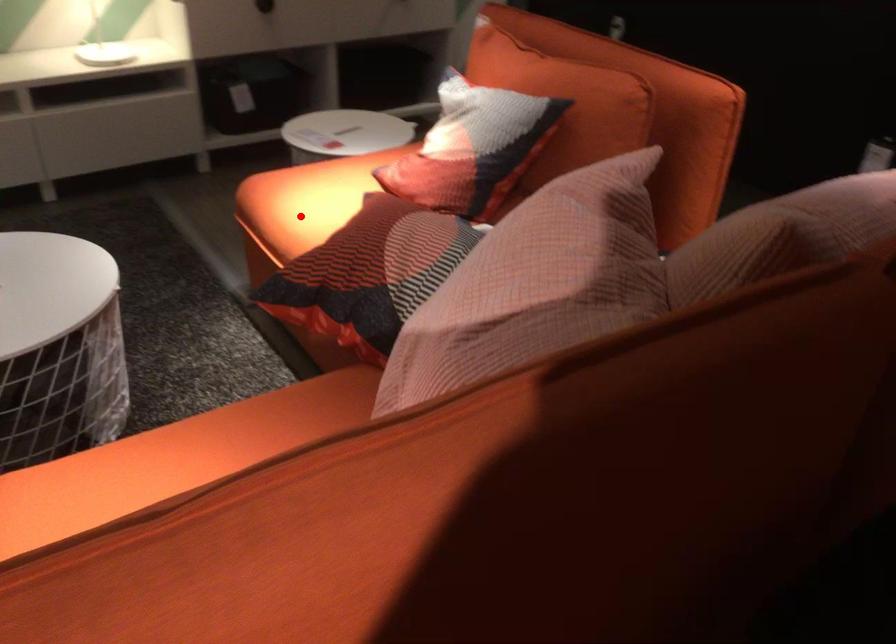
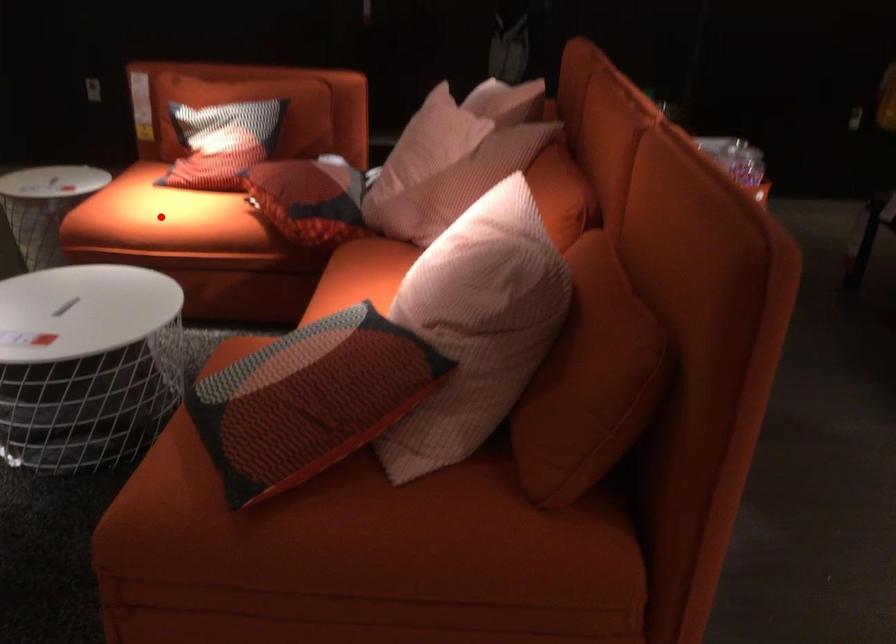
I am providing you with two images of the same scene from different viewpoints. A red point is marked on the first image and another point is marked on the second image. Does the point marked in image1 correspond to the same location as the one in image2?

Yes